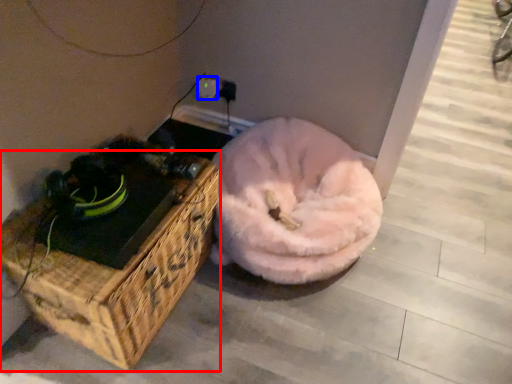
Question: Among these objects, which one is farthest to the camera, furniture (highlighted by a red box) or electric outlet (highlighted by a blue box)?

Choices:
 (A) furniture
 (B) electric outlet

Answer: (B)